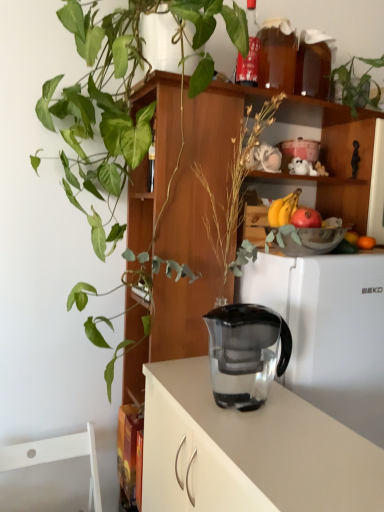
Question: Does red matte apple at upper right have a greater width compared to transparent plastic jug at center?

Choices:
 (A) yes
 (B) no

Answer: (B)

Question: Is red matte apple at upper right to the right of transparent plastic jug at center from the viewer's perspective?

Choices:
 (A) no
 (B) yes

Answer: (B)

Question: Is red matte apple at upper right looking in the opposite direction of transparent plastic jug at center?

Choices:
 (A) no
 (B) yes

Answer: (A)

Question: Considering the relative positions of red matte apple at upper right and transparent plastic jug at center in the image provided, is red matte apple at upper right in front of transparent plastic jug at center?

Choices:
 (A) no
 (B) yes

Answer: (A)

Question: Is red matte apple at upper right positioned beyond the bounds of transparent plastic jug at center?

Choices:
 (A) yes
 (B) no

Answer: (A)

Question: From their relative heights in the image, would you say green leafy plant at upper right, acting as the first houseplant starting from the right, is taller or shorter than green glossy plant at upper left, the first houseplant viewed from the left?

Choices:
 (A) short
 (B) tall

Answer: (A)

Question: Is point (365, 90) closer or farther from the camera than point (44, 92)?

Choices:
 (A) farther
 (B) closer

Answer: (A)

Question: In the image, is green leafy plant at upper right, acting as the first houseplant starting from the right, positioned in front of or behind green glossy plant at upper left, the first houseplant viewed from the left?

Choices:
 (A) front
 (B) behind

Answer: (B)

Question: From a real-world perspective, is green leafy plant at upper right, acting as the first houseplant starting from the right, physically located above or below green glossy plant at upper left, the first houseplant viewed from the left?

Choices:
 (A) above
 (B) below

Answer: (A)

Question: Is point (329, 327) positioned closer to the camera than point (309, 226)?

Choices:
 (A) closer
 (B) farther

Answer: (A)

Question: Which is correct: white matte refrigerator at center is inside red matte apple at upper right, or outside of it?

Choices:
 (A) inside
 (B) outside

Answer: (B)

Question: In terms of height, does white matte refrigerator at center look taller or shorter compared to red matte apple at upper right?

Choices:
 (A) tall
 (B) short

Answer: (A)

Question: From a real-world perspective, relative to red matte apple at upper right, is white matte refrigerator at center vertically above or below?

Choices:
 (A) above
 (B) below

Answer: (B)

Question: In terms of size, does matte glass bottle at upper center appear bigger or smaller than green leafy plant at upper right, the 2th houseplant positioned from the left?

Choices:
 (A) small
 (B) big

Answer: (A)

Question: Considering their positions, is matte glass bottle at upper center located in front of or behind green leafy plant at upper right, acting as the first houseplant starting from the right?

Choices:
 (A) front
 (B) behind

Answer: (A)